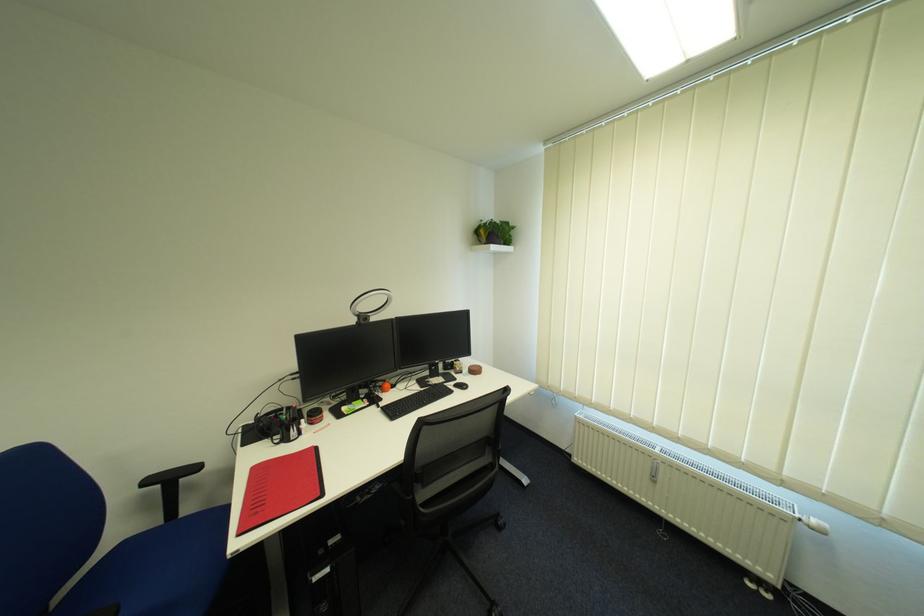
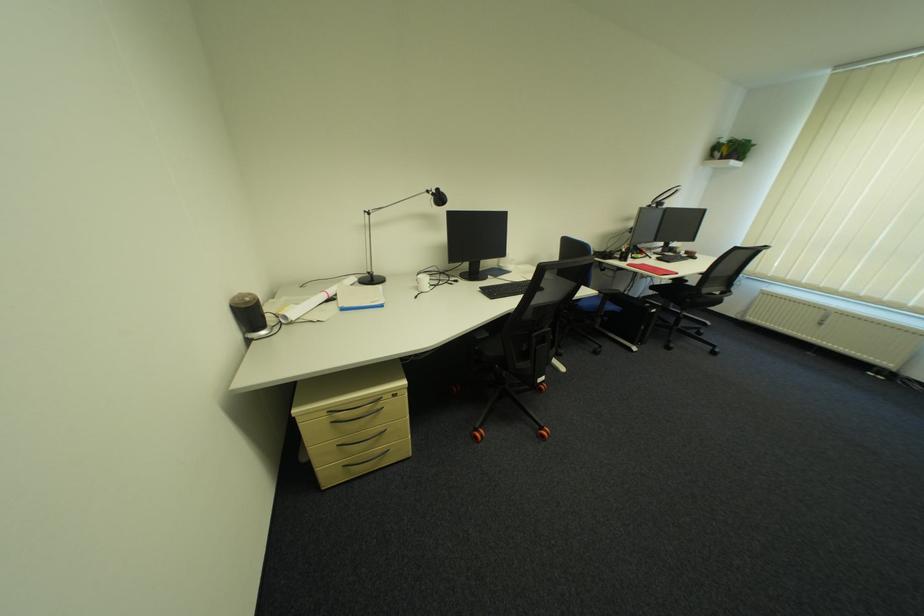
Which direction would the cameraman need to move to produce the second image?

The movement direction of the cameraman is left, backward.